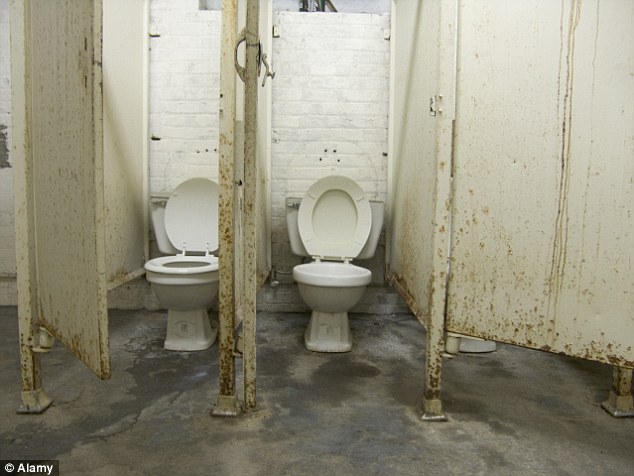
Locate an element on the screen. toilet seat is located at coordinates (152, 263), (309, 198).